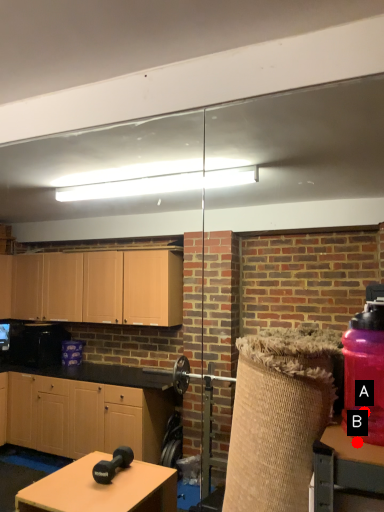
Question: Two points are circled on the image, labeled by A and B beside each circle. Which point appears farthest from the camera in this image?

Choices:
 (A) A is further
 (B) B is further

Answer: (A)